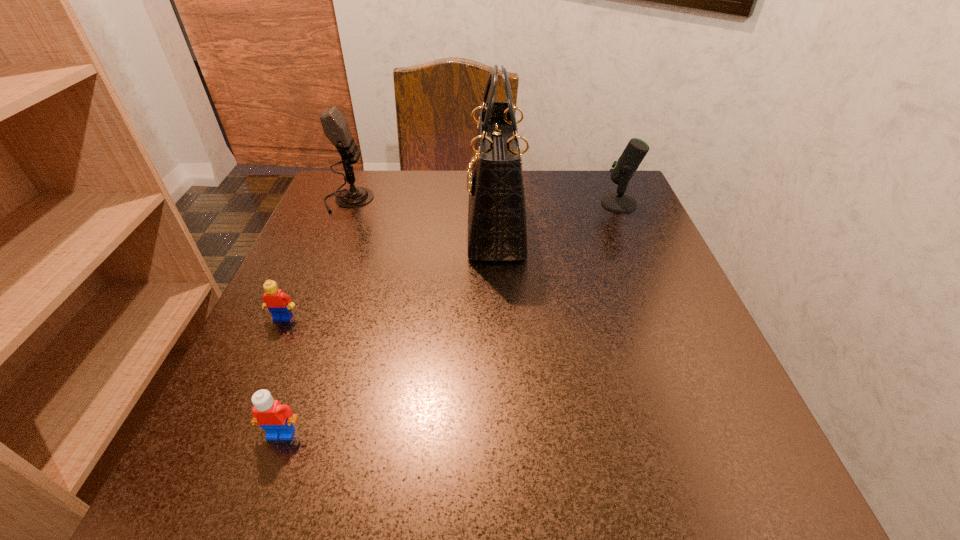
Locate an element on the screen. The image size is (960, 540). the second object from right to left is located at coordinates (497, 229).

Where is `handbag`? handbag is located at coordinates (497, 229).

You are a GUI agent. You are given a task and a screenshot of the screen. Output one action in this format:
    pyautogui.click(x=<x>, y=<y>)
    Task: Click on the taller microphone
    The width and height of the screenshot is (960, 540).
    Given the screenshot: What is the action you would take?
    pyautogui.click(x=336, y=129)

Where is `the left microphone`? the left microphone is located at coordinates (336, 129).

Find the location of `the shorter microphone`. the shorter microphone is located at coordinates (623, 169).

The height and width of the screenshot is (540, 960). In order to click on the rightmost object in this screenshot , I will do `click(623, 169)`.

At what (x,y) coordinates should I click in order to perform the action: click on the right Lego. Please return your answer as a coordinate pair (x, y). Looking at the image, I should click on (277, 419).

Identify the location of the nearest object. (277, 419).

Locate an element on the screen. Image resolution: width=960 pixels, height=540 pixels. the fourth farthest object is located at coordinates (279, 304).

The height and width of the screenshot is (540, 960). Identify the location of the farther Lego. (279, 304).